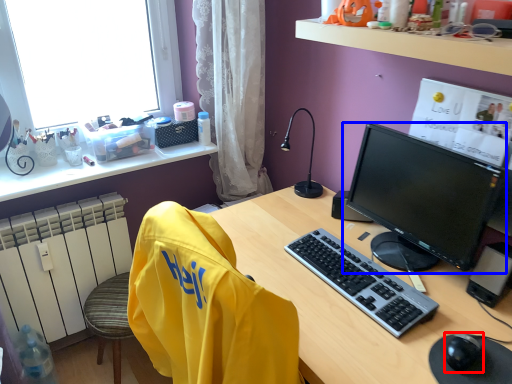
Question: Which point is closer to the camera, mouse (highlighted by a red box) or computer monitor (highlighted by a blue box)?

Choices:
 (A) mouse
 (B) computer monitor

Answer: (A)